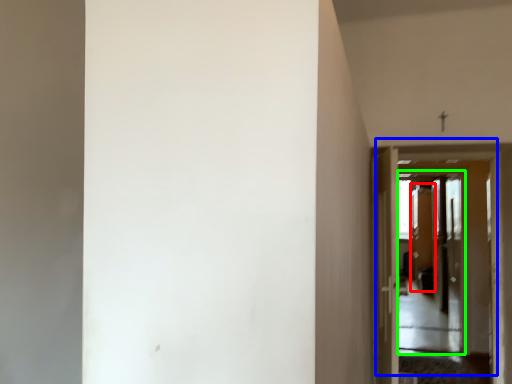
Question: Which is nearer to the screen door (highlighted by a red box)? door (highlighted by a blue box) or screen door (highlighted by a green box).

Choices:
 (A) door
 (B) screen door

Answer: (B)